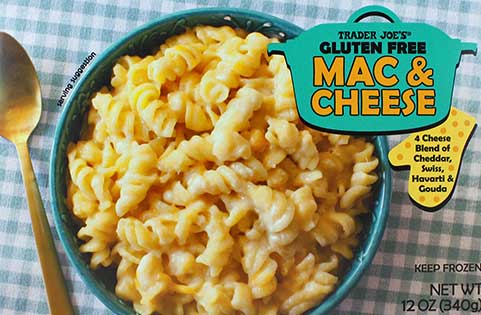
Where is `picture of yellow oven mit`? Image resolution: width=481 pixels, height=315 pixels. picture of yellow oven mit is located at coordinates (428, 200).